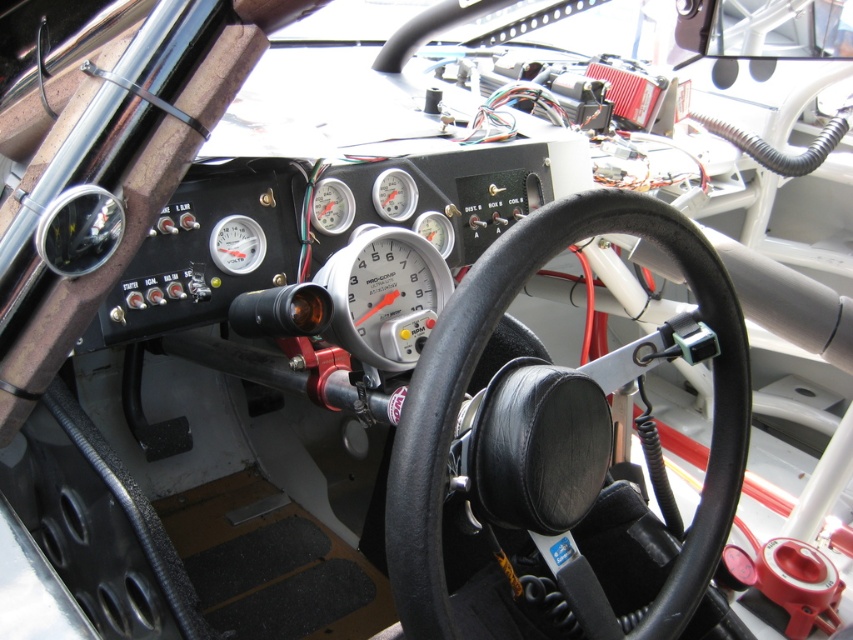
Question: Does black leather steering wheel at center have a smaller size compared to silver metallic speedometer at center?

Choices:
 (A) yes
 (B) no

Answer: (B)

Question: Is silver metallic speedometer at center to the right of white plastic speedometer at center from the viewer's perspective?

Choices:
 (A) yes
 (B) no

Answer: (A)

Question: Is black leather steering wheel at center further to the viewer compared to silver metallic speedometer at center?

Choices:
 (A) yes
 (B) no

Answer: (B)

Question: Which point is closer to the camera?

Choices:
 (A) black leather steering wheel at center
 (B) silver metallic speedometer at center

Answer: (A)

Question: Which point is farther from the camera taking this photo?

Choices:
 (A) (323, 276)
 (B) (498, 268)

Answer: (A)

Question: Which of the following is the closest to the observer?

Choices:
 (A) (460, 400)
 (B) (422, 314)
 (C) (225, 236)

Answer: (A)